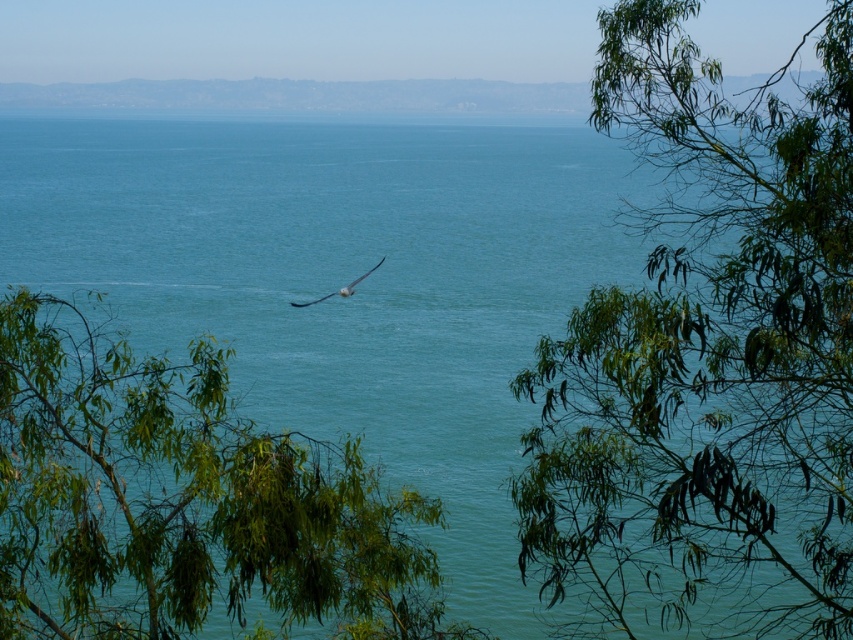
Which is in front, point (840, 548) or point (343, 292)?

Positioned in front is point (840, 548).

Is the position of green leafy branches at upper right less distant than that of white feathered bird at center?

Yes.

Is point (640, 124) less distant than point (349, 292)?

Yes, point (640, 124) is closer to viewer.

Find the location of a particular element. The height and width of the screenshot is (640, 853). green leafy branches at upper right is located at coordinates (708, 356).

Which of these two, green leafy tree at center or white feathered bird at center, stands shorter?

white feathered bird at center

Is point (16, 346) positioned after point (383, 259)?

No, it is in front of (383, 259).

Who is more distant from viewer, (200, 524) or (341, 289)?

The point (341, 289) is behind.

What are the coordinates of `green leafy tree at center` in the screenshot? It's located at (184, 500).

Between green leafy branches at upper right and green leafy tree at center, which one is positioned lower?

green leafy tree at center

Does point (633, 80) come farther from viewer compared to point (28, 401)?

Yes.

Is point (552, 456) closer to camera compared to point (328, 525)?

No, it is not.

Find the location of a particular element. green leafy branches at upper right is located at coordinates (708, 356).